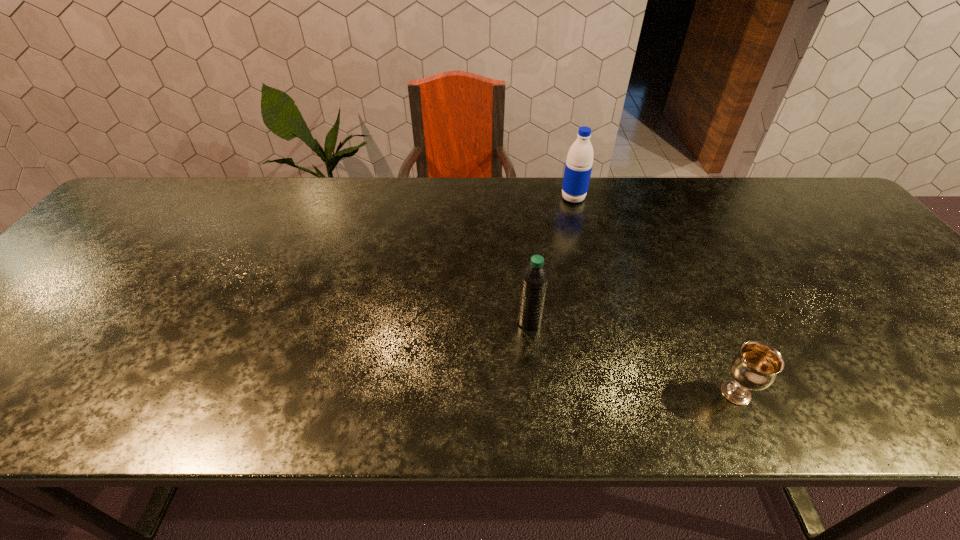
Identify the location of object that is at the near edge. (755, 367).

Identify the location of free region at the far edge of the desktop. The height and width of the screenshot is (540, 960). (668, 185).

I want to click on vacant space at the near edge of the desktop, so click(x=884, y=416).

Find the location of a particular element. The image size is (960, 540). vacant space at the left edge of the desktop is located at coordinates (51, 308).

This screenshot has height=540, width=960. In the image, there is a desktop. In order to click on vacant space at the right edge in this screenshot , I will do `click(806, 227)`.

This screenshot has width=960, height=540. What are the coordinates of `empty space between the rightmost object and the farther water bottle` in the screenshot? It's located at (655, 295).

Where is `vacant space in between the right water bottle and the shortest object`? This screenshot has height=540, width=960. vacant space in between the right water bottle and the shortest object is located at coordinates (655, 295).

Locate an element on the screen. Image resolution: width=960 pixels, height=540 pixels. free space between the second shortest object and the shortest object is located at coordinates 633,357.

The width and height of the screenshot is (960, 540). Find the location of `free space that is in between the right water bottle and the shortest object`. free space that is in between the right water bottle and the shortest object is located at coordinates (655, 295).

The height and width of the screenshot is (540, 960). In order to click on vacant area that lies between the nearest object and the second object from left to right in this screenshot , I will do `click(655, 295)`.